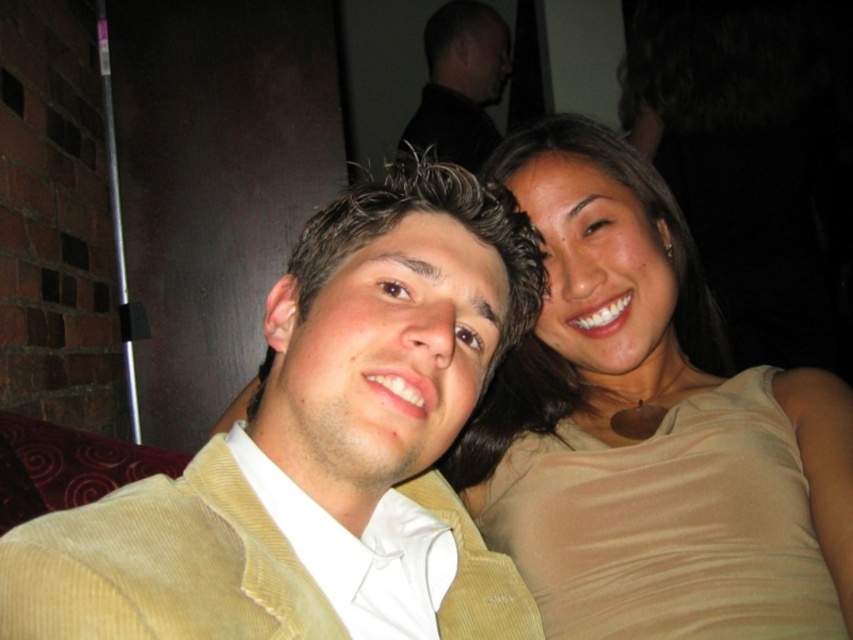
Question: Which point is closer to the camera taking this photo?

Choices:
 (A) (337, 333)
 (B) (450, 45)
 (C) (636, 260)

Answer: (A)

Question: Is yellow corduroy jacket at center bigger than black corduroy jacket at upper center?

Choices:
 (A) yes
 (B) no

Answer: (B)

Question: Is the position of matte beige tank top at right more distant than that of yellow corduroy jacket at center?

Choices:
 (A) no
 (B) yes

Answer: (B)

Question: Considering the relative positions of matte beige tank top at right and yellow corduroy jacket at center in the image provided, where is matte beige tank top at right located with respect to yellow corduroy jacket at center?

Choices:
 (A) below
 (B) above

Answer: (B)

Question: Which is nearer to the black corduroy jacket at upper center?

Choices:
 (A) matte beige tank top at right
 (B) yellow corduroy jacket at center

Answer: (A)

Question: Which point is closer to the camera taking this photo?

Choices:
 (A) (483, 13)
 (B) (581, 490)

Answer: (B)